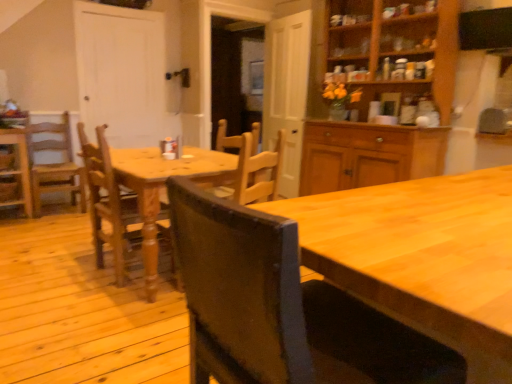
Question: Considering the positions of black matte exhaust hood at upper right and light brown wooden chair at left, the first chair positioned from the back, in the image, is black matte exhaust hood at upper right bigger or smaller than light brown wooden chair at left, the first chair positioned from the back,?

Choices:
 (A) small
 (B) big

Answer: (A)

Question: Considering their positions, is black matte exhaust hood at upper right located in front of or behind light brown wooden chair at left, arranged as the third chair when viewed from the right?

Choices:
 (A) front
 (B) behind

Answer: (A)

Question: Estimate the real-world distances between objects in this image. Which object is closer to the wooden chair at center, which is the fourth chair in back-to-front order?

Choices:
 (A) wooden chair at left, the fourth chair viewed from the right
 (B) light brown wooden chair at left, acting as the 4th chair starting from the front
 (C) wooden chair at center, which ranks as the 3th chair in back-to-front order
 (D) wooden table at center
 (E) black matte exhaust hood at upper right

Answer: (D)

Question: Based on their relative distances, which object is nearer to the wooden chair at center, the first chair when ordered from right to left?

Choices:
 (A) black matte exhaust hood at upper right
 (B) wooden table at center
 (C) light brown wooden chair at left, acting as the 4th chair starting from the front
 (D) wooden chair at center, which ranks as the 3th chair in back-to-front order
 (E) wooden chair at left, which is the 2th chair in back-to-front order

Answer: (B)